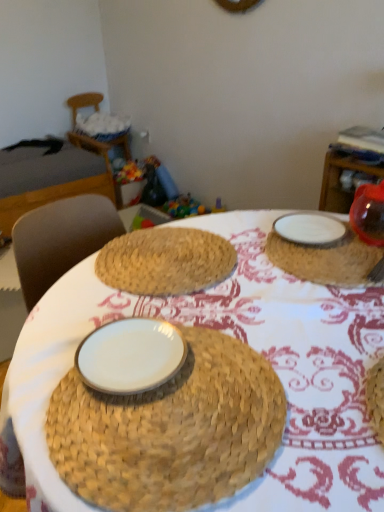
Question: Is white glossy plate at center, which ranks as the 1th plate in bottom-to-top order, not close to white woven basket at upper left?

Choices:
 (A) no
 (B) yes

Answer: (B)

Question: From a real-world perspective, is white glossy plate at center, the first plate in the front-to-back sequence, physically above white woven basket at upper left?

Choices:
 (A) yes
 (B) no

Answer: (A)

Question: Can you confirm if white glossy plate at center, which ranks as the 1th plate in bottom-to-top order, is wider than white woven basket at upper left?

Choices:
 (A) yes
 (B) no

Answer: (B)

Question: Is white woven basket at upper left a part of white glossy plate at center, the 2th plate viewed from the right?

Choices:
 (A) yes
 (B) no

Answer: (B)

Question: From a real-world perspective, is white glossy plate at center, the 2th plate viewed from the right, under white woven basket at upper left?

Choices:
 (A) no
 (B) yes

Answer: (A)

Question: From the image's perspective, is white ceramic plate at upper right above or below dark gray fabric bed at left?

Choices:
 (A) above
 (B) below

Answer: (B)

Question: Is white ceramic plate at upper right wider or thinner than dark gray fabric bed at left?

Choices:
 (A) thin
 (B) wide

Answer: (A)

Question: Choose the correct answer: Is white ceramic plate at upper right inside dark gray fabric bed at left or outside it?

Choices:
 (A) outside
 (B) inside

Answer: (A)

Question: In the image, is white ceramic plate at upper right positioned in front of or behind dark gray fabric bed at left?

Choices:
 (A) behind
 (B) front

Answer: (B)

Question: Would you say white glossy plate at center, the first plate in the front-to-back sequence, is to the left or to the right of translucent plastic toy at center in the picture?

Choices:
 (A) right
 (B) left

Answer: (B)

Question: Based on their sizes in the image, would you say white glossy plate at center, which ranks as the 1th plate in bottom-to-top order, is bigger or smaller than translucent plastic toy at center?

Choices:
 (A) big
 (B) small

Answer: (B)

Question: In the image, is white glossy plate at center, the 2th plate viewed from the back, positioned in front of or behind translucent plastic toy at center?

Choices:
 (A) behind
 (B) front

Answer: (B)

Question: In terms of width, does white glossy plate at center, which ranks as the 1th plate in bottom-to-top order, look wider or thinner when compared to translucent plastic toy at center?

Choices:
 (A) wide
 (B) thin

Answer: (B)

Question: From the image's perspective, relative to white woven basket at upper left, is dark gray fabric bed at left above or below?

Choices:
 (A) above
 (B) below

Answer: (B)

Question: From a real-world perspective, relative to white woven basket at upper left, is dark gray fabric bed at left vertically above or below?

Choices:
 (A) below
 (B) above

Answer: (A)